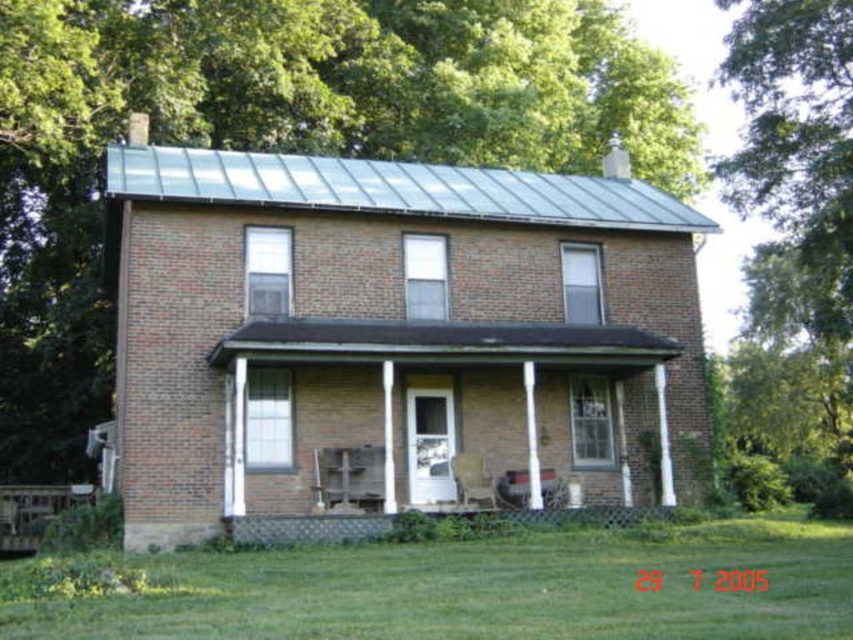
Based on the scene description, where is the brick porch at center located in terms of coordinates?

The brick porch at center is located at coordinates point (431, 356).

You are standing on the wooden porch at lower center and want to move to the brick porch at center. Which direction should you move to reach it?

The brick porch at center is to the right of wooden porch at lower center, so you should move to the right to reach it.

You are standing on the wooden porch at lower center and want to reach the brick porch at center. Can you walk directly upwards to get there?

The brick porch at center is located above the wooden porch at lower center, so yes, you can walk directly upwards to reach the brick porch at center from the wooden porch at lower center.